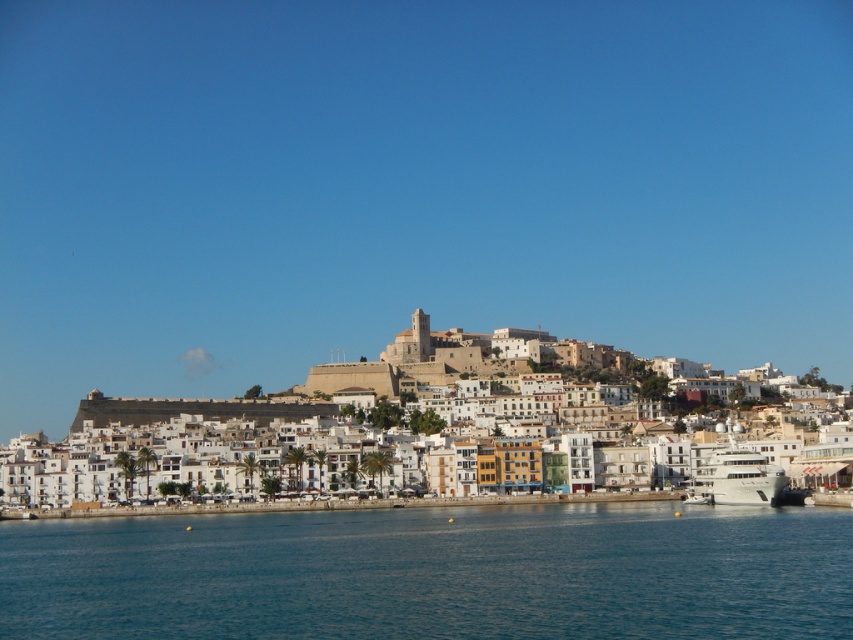
Question: Is blue water at lower center closer to the viewer compared to white matte buildings at center?

Choices:
 (A) yes
 (B) no

Answer: (A)

Question: Does blue water at lower center have a smaller size compared to white glossy yacht at lower right?

Choices:
 (A) no
 (B) yes

Answer: (A)

Question: Which object appears closest to the camera in this image?

Choices:
 (A) white matte buildings at center
 (B) white glossy yacht at lower right
 (C) blue water at lower center

Answer: (C)

Question: Which of these objects is positioned closest to the white matte buildings at center?

Choices:
 (A) white glossy yacht at lower right
 (B) blue water at lower center

Answer: (B)

Question: Is blue water at lower center bigger than white glossy yacht at lower right?

Choices:
 (A) no
 (B) yes

Answer: (B)

Question: Which point is farther to the camera?

Choices:
 (A) blue water at lower center
 (B) white glossy yacht at lower right

Answer: (B)